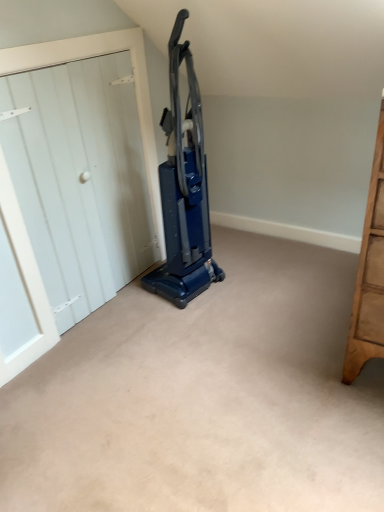
Identify the location of free point to the left of blue plastic vacuum cleaner at center. This screenshot has width=384, height=512. (134, 302).